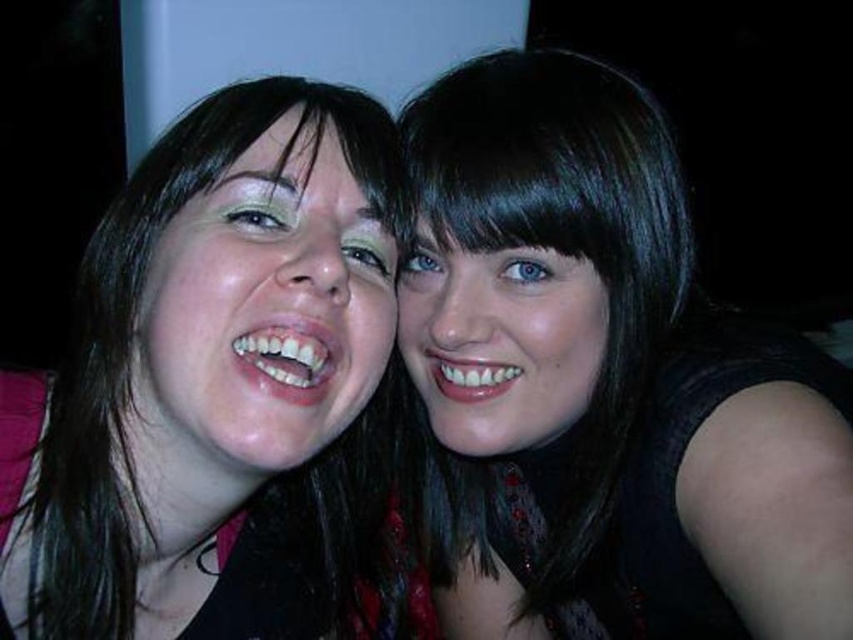
Who is shorter, matte skin face at left or smooth skin face at center?

Standing shorter between the two is smooth skin face at center.

Locate an element on the screen. The width and height of the screenshot is (853, 640). matte skin face at left is located at coordinates (262, 310).

The image size is (853, 640). In order to click on matte skin face at left in this screenshot , I will do `click(262, 310)`.

Is matte black hair at left bigger than smooth skin face at center?

Yes, matte black hair at left is bigger than smooth skin face at center.

Between point (329, 205) and point (508, 260), which one is positioned behind?

Point (508, 260)

Where is `matte black hair at left`? matte black hair at left is located at coordinates (215, 385).

In the scene shown: Which is more to the right, black matte hair at upper right or matte black hair at left?

Positioned to the right is black matte hair at upper right.

Is black matte hair at upper right bigger than matte black hair at left?

Yes, black matte hair at upper right is bigger than matte black hair at left.

This screenshot has width=853, height=640. What are the coordinates of `black matte hair at upper right` in the screenshot? It's located at (602, 384).